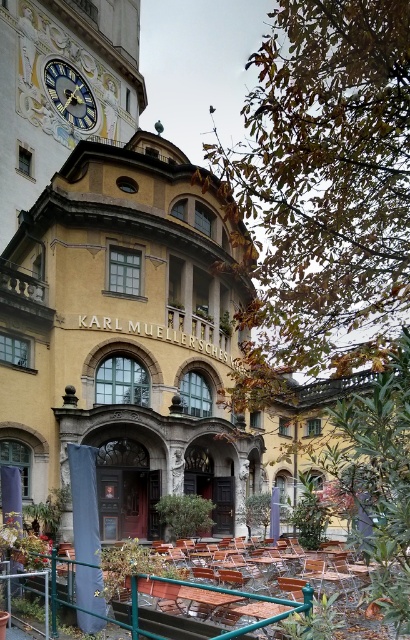
Question: Which point is closer to the camera taking this photo?

Choices:
 (A) (182, 486)
 (B) (246, 596)

Answer: (B)

Question: Can you confirm if yellow stone building at center is positioned above gold metallic clock at upper left?

Choices:
 (A) yes
 (B) no

Answer: (B)

Question: Among these objects, which one is nearest to the camera?

Choices:
 (A) green metal rail at lower center
 (B) yellow stone building at center

Answer: (A)

Question: Which point is closer to the camera?

Choices:
 (A) green metal rail at lower center
 (B) gold metallic clock at upper left
 (C) yellow stone building at center

Answer: (A)

Question: Does yellow stone building at center have a smaller size compared to gold metallic clock at upper left?

Choices:
 (A) no
 (B) yes

Answer: (A)

Question: Does yellow stone building at center have a smaller size compared to green metal rail at lower center?

Choices:
 (A) no
 (B) yes

Answer: (A)